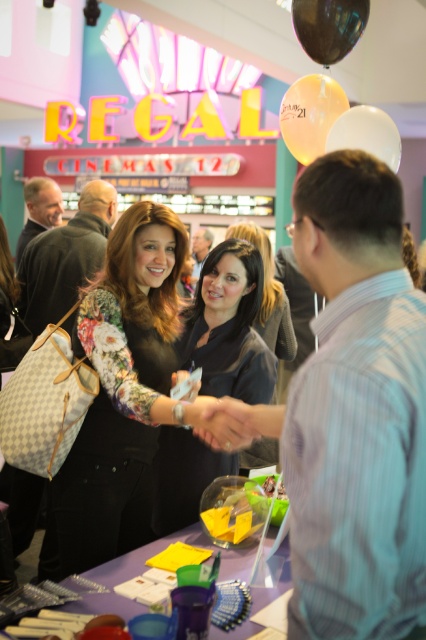
Question: Which point appears closest to the camera in this image?

Choices:
 (A) (244, 333)
 (B) (252, 448)
 (C) (146, 368)

Answer: (C)

Question: In this image, where is dark brown hair at center located relative to translucent white balloon at upper center?

Choices:
 (A) above
 (B) below

Answer: (B)

Question: Based on their relative distances, which object is farther from the purple plastic table at center?

Choices:
 (A) translucent white balloon at upper center
 (B) floral-patterned fabric at center
 (C) glossy black balloon at upper center

Answer: (A)

Question: Where is dark brown leather jacket at center located in relation to glossy black balloon at upper center in the image?

Choices:
 (A) left
 (B) right

Answer: (A)

Question: Which of the following is the farthest from the observer?

Choices:
 (A) (253, 445)
 (B) (350, 26)

Answer: (A)

Question: Can you confirm if floral-patterned fabric at center is bigger than glossy black balloon at upper center?

Choices:
 (A) yes
 (B) no

Answer: (A)